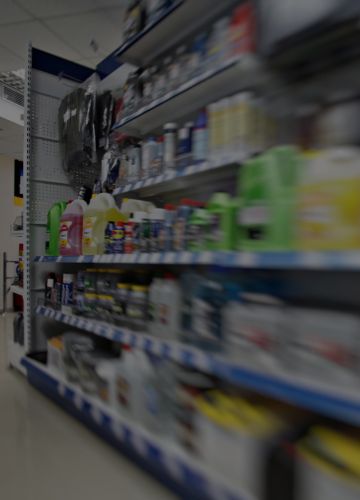
This screenshot has height=500, width=360. I want to click on white floor, so click(x=76, y=463).